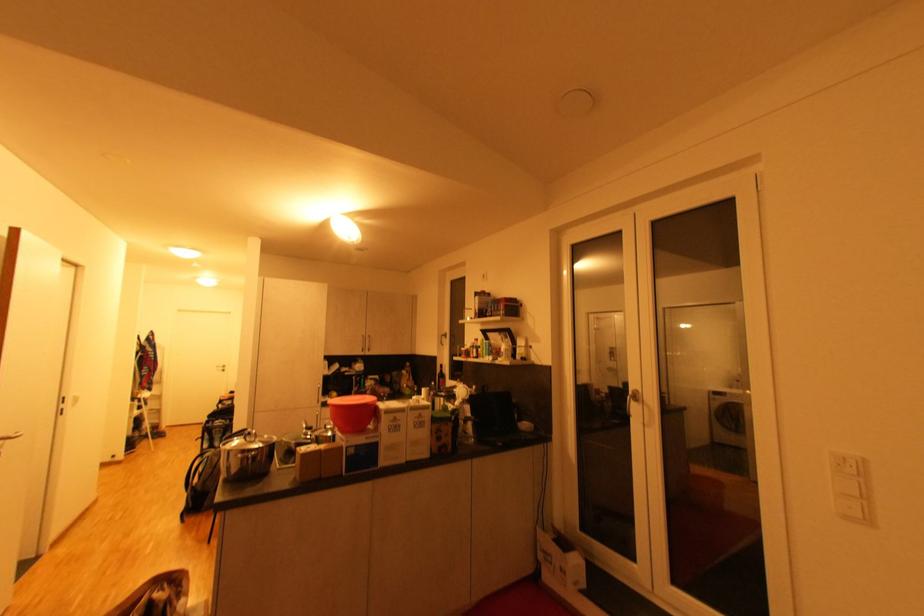
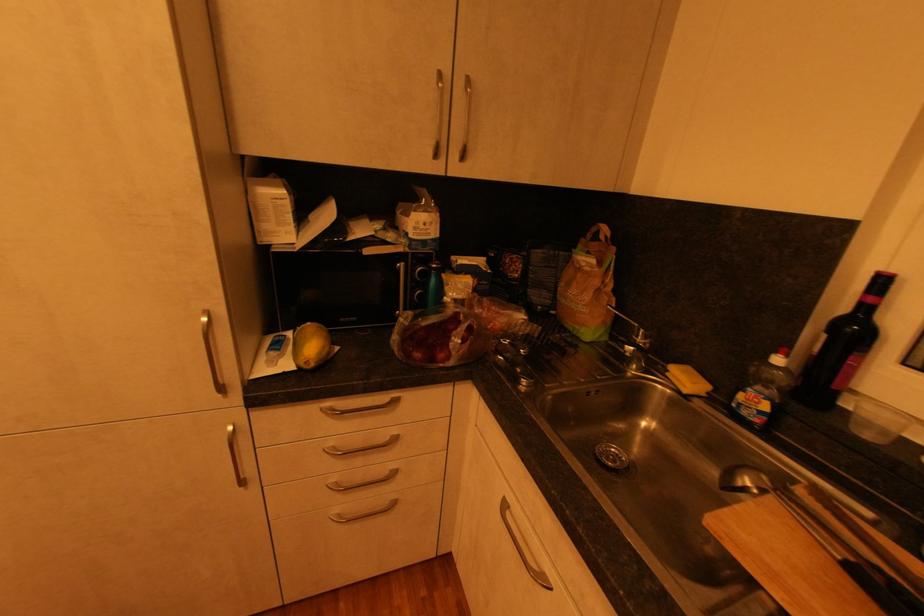
Where in the second image is the point corresponding to point 411,373 from the first image?

(604, 264)